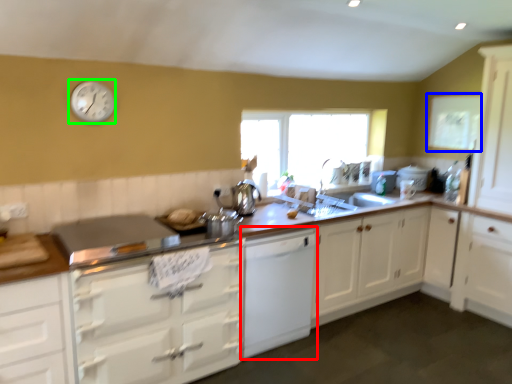
Question: Which object is the closest to the cabinetry (highlighted by a red box)? Choose among these: window screen (highlighted by a blue box) or clock (highlighted by a green box).

Choices:
 (A) window screen
 (B) clock

Answer: (B)